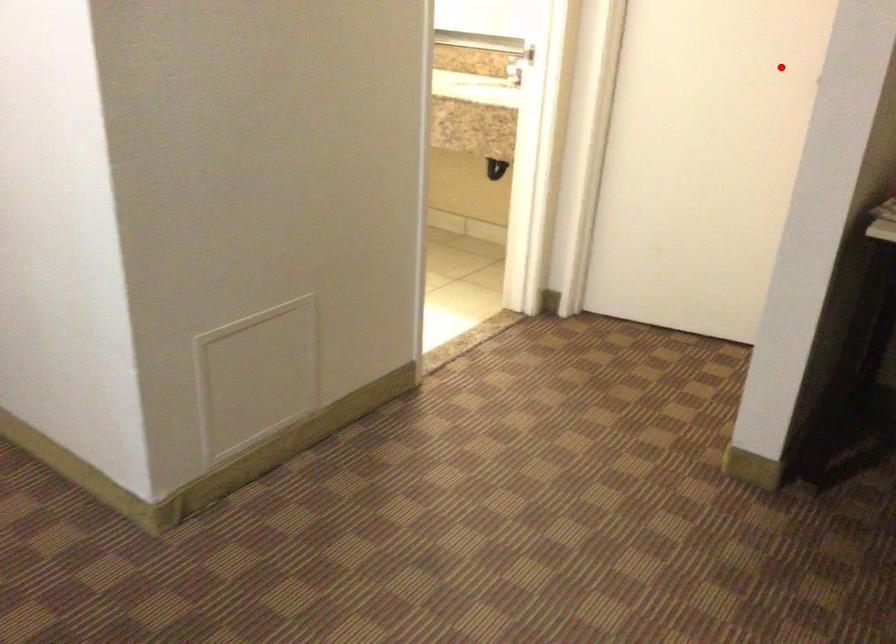
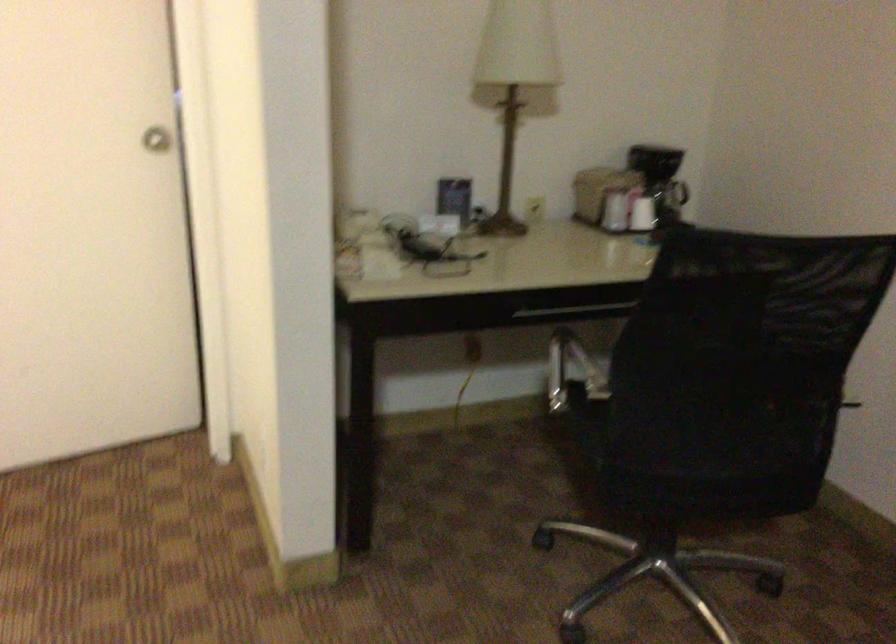
Locate, in the second image, the point that corresponds to the highlighted location in the first image.

(156, 138)